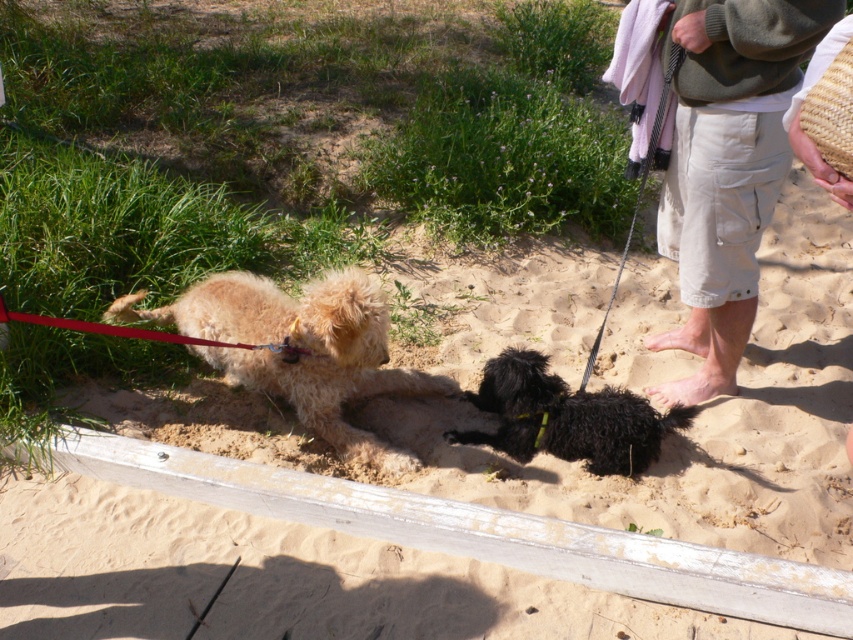
Who is lower down, sandy yellow sand at center or beige cotton shorts at right?

Positioned lower is sandy yellow sand at center.

Is point (792, 202) behind point (717, 177)?

Yes, it is behind point (717, 177).

Does point (90, 522) come closer to viewer compared to point (666, 227)?

Yes, it is.

Identify the location of sandy yellow sand at center. (274, 579).

Can you confirm if sandy yellow sand at center is wider than black fuzzy dog at center?

Correct, the width of sandy yellow sand at center exceeds that of black fuzzy dog at center.

Which is in front, point (756, 404) or point (518, 401)?

Point (518, 401)

Describe the element at coordinates (274, 579) in the screenshot. I see `sandy yellow sand at center` at that location.

What are the coordinates of `sandy yellow sand at center` in the screenshot? It's located at (274, 579).

Which is above, sandy yellow sand at center or fuzzy golden dog at center?

Positioned higher is fuzzy golden dog at center.

Is sandy yellow sand at center above fuzzy golden dog at center?

No, sandy yellow sand at center is not above fuzzy golden dog at center.

This screenshot has height=640, width=853. In order to click on sandy yellow sand at center in this screenshot , I will do 274,579.